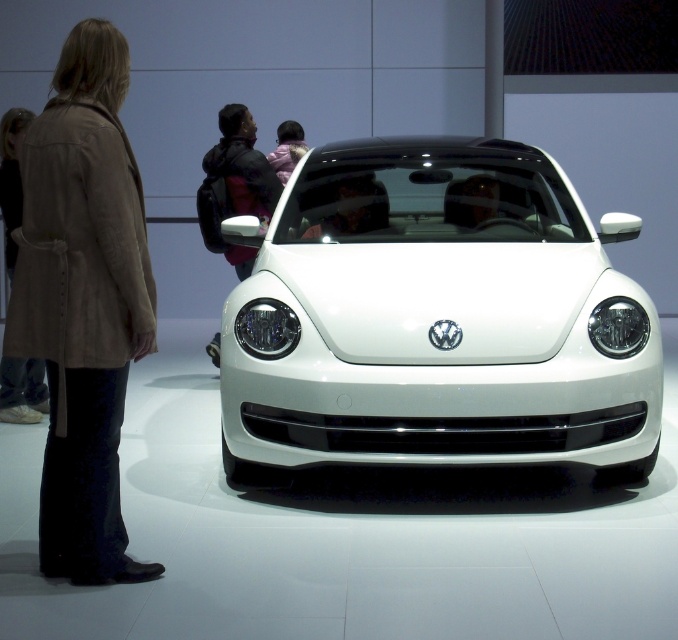
Question: Which point is farther from the camera taking this photo?

Choices:
 (A) (358, 192)
 (B) (98, 330)

Answer: (A)

Question: Which point is closer to the camera taking this photo?

Choices:
 (A) (355, 186)
 (B) (100, 372)

Answer: (B)

Question: From the image, what is the correct spatial relationship of white glossy car at center in relation to suede coat at left?

Choices:
 (A) below
 (B) above

Answer: (B)

Question: Is white glossy car at center bigger than suede coat at left?

Choices:
 (A) no
 (B) yes

Answer: (B)

Question: Does white glossy car at center appear under suede coat at left?

Choices:
 (A) yes
 (B) no

Answer: (B)